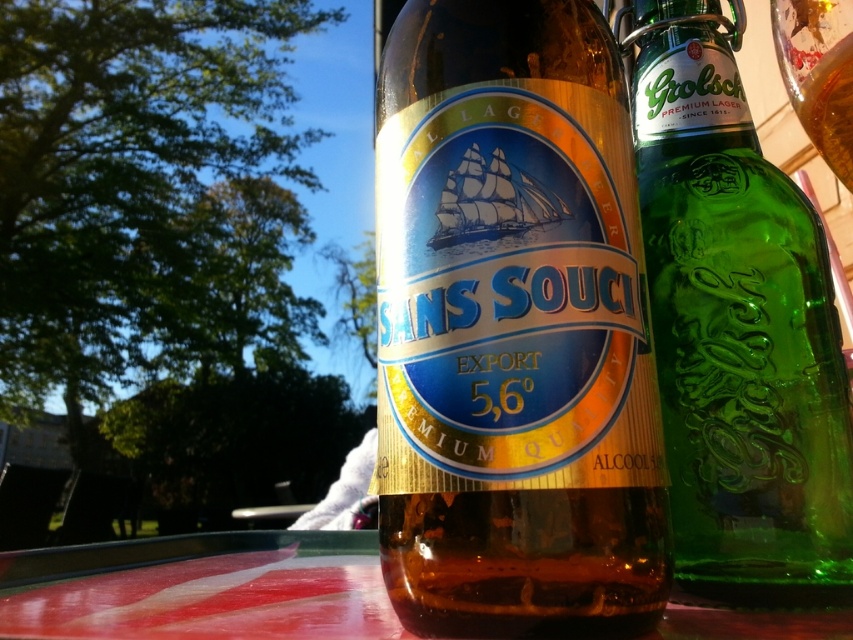
This screenshot has height=640, width=853. Identify the location of brown glass bottle at center. (515, 332).

Is point (492, 170) farther from camera compared to point (819, 525)?

No.

Does point (647, 390) come closer to viewer compared to point (654, 22)?

Yes, point (647, 390) is closer to viewer.

The height and width of the screenshot is (640, 853). In order to click on brown glass bottle at center in this screenshot , I will do `click(515, 332)`.

From the picture: Who is taller, brown glass bottle at center or transparent glass at upper right?

brown glass bottle at center is taller.

From the picture: Can you confirm if brown glass bottle at center is positioned above transparent glass at upper right?

No, brown glass bottle at center is not above transparent glass at upper right.

Is point (518, 264) more distant than point (848, 140)?

That is True.

Where is `brown glass bottle at center`? The width and height of the screenshot is (853, 640). brown glass bottle at center is located at coordinates (515, 332).

Which is above, smooth glossy table at center or transparent glass at upper right?

Positioned higher is transparent glass at upper right.

What do you see at coordinates (200, 588) in the screenshot?
I see `smooth glossy table at center` at bounding box center [200, 588].

Where is `smooth glossy table at center`? smooth glossy table at center is located at coordinates (200, 588).